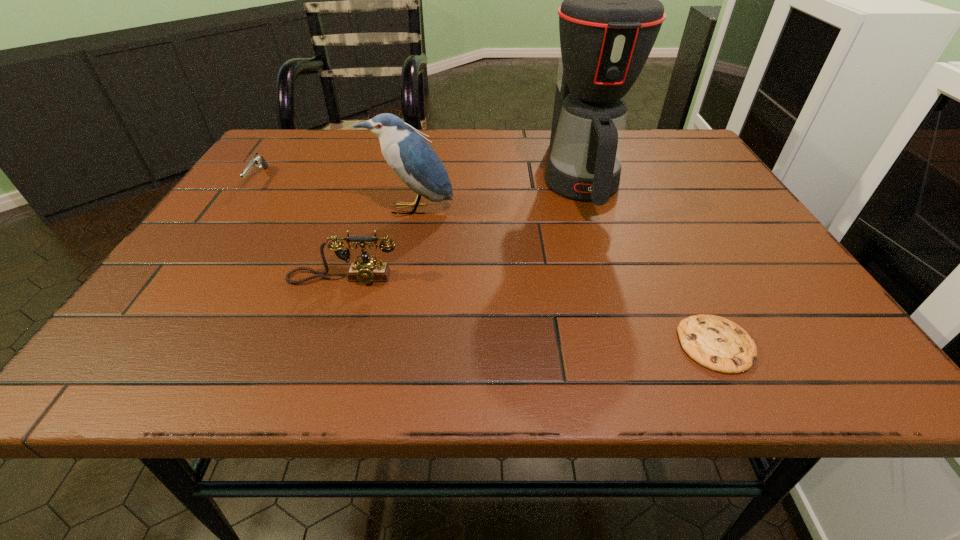
In the image, there is a desktop. Where is `vacant space at the far edge`? The image size is (960, 540). vacant space at the far edge is located at coordinates (484, 131).

The width and height of the screenshot is (960, 540). In the image, there is a desktop. What are the coordinates of `vacant space at the left edge` in the screenshot? It's located at (198, 261).

The width and height of the screenshot is (960, 540). Identify the location of vacant region at the right edge of the desktop. (770, 312).

In order to click on vacant space at the far right corner in this screenshot , I will do (690, 166).

Image resolution: width=960 pixels, height=540 pixels. Identify the location of vacant space in between the telephone and the pistol. (300, 228).

The image size is (960, 540). Find the location of `free space between the telephone and the second shortest object`. free space between the telephone and the second shortest object is located at coordinates pos(300,228).

At what (x,y) coordinates should I click in order to perform the action: click on free area in between the cookie and the coffee maker. Please return your answer as a coordinate pair (x, y). Looking at the image, I should click on (648, 261).

I want to click on unoccupied area between the coffee maker and the bird, so click(495, 194).

The height and width of the screenshot is (540, 960). I want to click on empty space that is in between the fourth farthest object and the second shortest object, so click(300, 228).

You are a GUI agent. You are given a task and a screenshot of the screen. Output one action in this format:
    pyautogui.click(x=<x>, y=<y>)
    Task: Click on the vacant space that's between the telephone and the bird
    This screenshot has height=540, width=960.
    Given the screenshot: What is the action you would take?
    pyautogui.click(x=377, y=244)